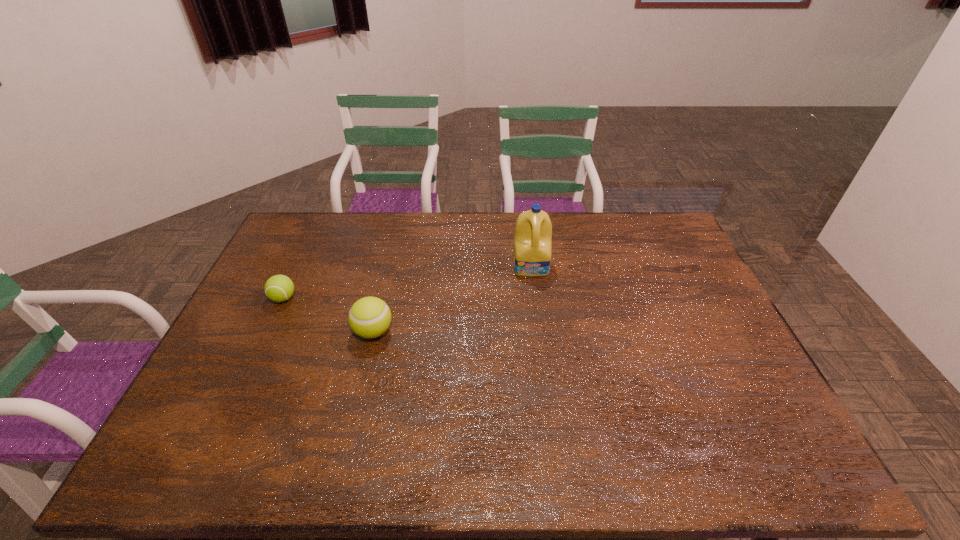
This screenshot has height=540, width=960. Find the location of `detergent`. detergent is located at coordinates (533, 234).

In order to click on the farthest object in this screenshot , I will do coord(533,234).

Find the location of a particular element. This screenshot has height=540, width=960. the nearest object is located at coordinates (369, 317).

At what (x,y) coordinates should I click in order to perform the action: click on the second object from left to right. Please return your answer as a coordinate pair (x, y). Image resolution: width=960 pixels, height=540 pixels. Looking at the image, I should click on (369, 317).

Where is `the shortest object`? The height and width of the screenshot is (540, 960). the shortest object is located at coordinates (279, 288).

At what (x,y) coordinates should I click in order to perform the action: click on the leftmost object. Please return your answer as a coordinate pair (x, y). This screenshot has height=540, width=960. Looking at the image, I should click on (279, 288).

Find the location of `vacant space located 0.390m on the label of the rightmost object`. vacant space located 0.390m on the label of the rightmost object is located at coordinates (546, 376).

Locate an element on the screen. vacant area located on the left of the taller tennis ball is located at coordinates (275, 332).

The image size is (960, 540). In order to click on blank space located on the right of the left tennis ball in this screenshot , I will do (382, 298).

This screenshot has height=540, width=960. What are the coordinates of `object at the left edge` in the screenshot? It's located at (279, 288).